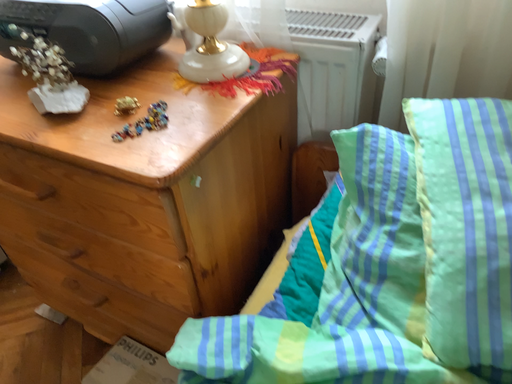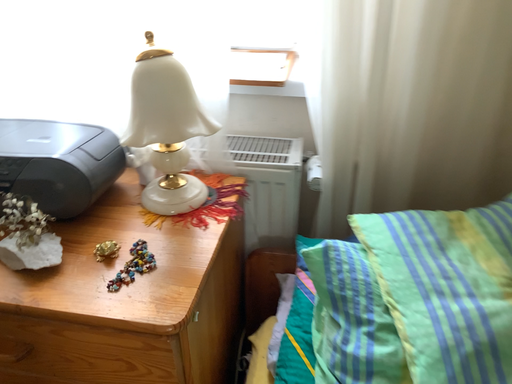
Question: Which way did the camera rotate in the video?

Choices:
 (A) rotated downward
 (B) rotated upward

Answer: (B)